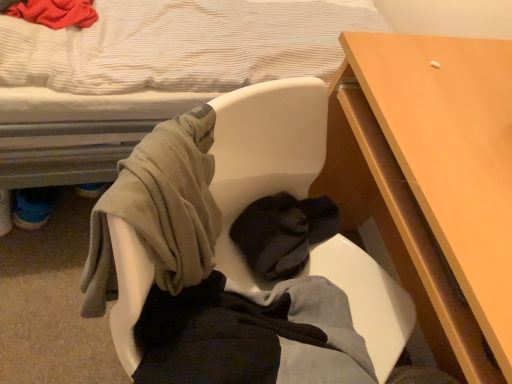
Question: Can you confirm if wooden desk at center right is bigger than soft fabric chair at center?

Choices:
 (A) no
 (B) yes

Answer: (B)

Question: Could you tell me if wooden desk at center right is turned towards soft fabric chair at center?

Choices:
 (A) yes
 (B) no

Answer: (A)

Question: Would you say wooden desk at center right is outside soft fabric chair at center?

Choices:
 (A) no
 (B) yes

Answer: (B)

Question: Can you confirm if wooden desk at center right is thinner than soft fabric chair at center?

Choices:
 (A) yes
 (B) no

Answer: (B)

Question: Considering the relative positions of wooden desk at center right and soft fabric chair at center in the image provided, is wooden desk at center right to the left of soft fabric chair at center from the viewer's perspective?

Choices:
 (A) yes
 (B) no

Answer: (B)

Question: Is soft fabric chair at center in front of or behind white fabric bed at upper left in the image?

Choices:
 (A) behind
 (B) front

Answer: (A)

Question: Is soft fabric chair at center inside the boundaries of white fabric bed at upper left, or outside?

Choices:
 (A) inside
 (B) outside

Answer: (B)

Question: From a real-world perspective, is soft fabric chair at center above or below white fabric bed at upper left?

Choices:
 (A) above
 (B) below

Answer: (A)

Question: From the image's perspective, is soft fabric chair at center located above or below white fabric bed at upper left?

Choices:
 (A) above
 (B) below

Answer: (B)

Question: Is white fabric bed at upper left situated inside soft fabric chair at center or outside?

Choices:
 (A) outside
 (B) inside

Answer: (A)

Question: From a real-world perspective, is white fabric bed at upper left above or below soft fabric chair at center?

Choices:
 (A) above
 (B) below

Answer: (B)

Question: Is white fabric bed at upper left to the left or to the right of soft fabric chair at center in the image?

Choices:
 (A) left
 (B) right

Answer: (A)

Question: In terms of width, does white fabric bed at upper left look wider or thinner when compared to soft fabric chair at center?

Choices:
 (A) wide
 (B) thin

Answer: (A)

Question: Relative to wooden desk at center right, is white fabric bed at upper left in front or behind?

Choices:
 (A) front
 (B) behind

Answer: (A)

Question: From the image's perspective, relative to wooden desk at center right, is white fabric bed at upper left above or below?

Choices:
 (A) below
 (B) above

Answer: (B)